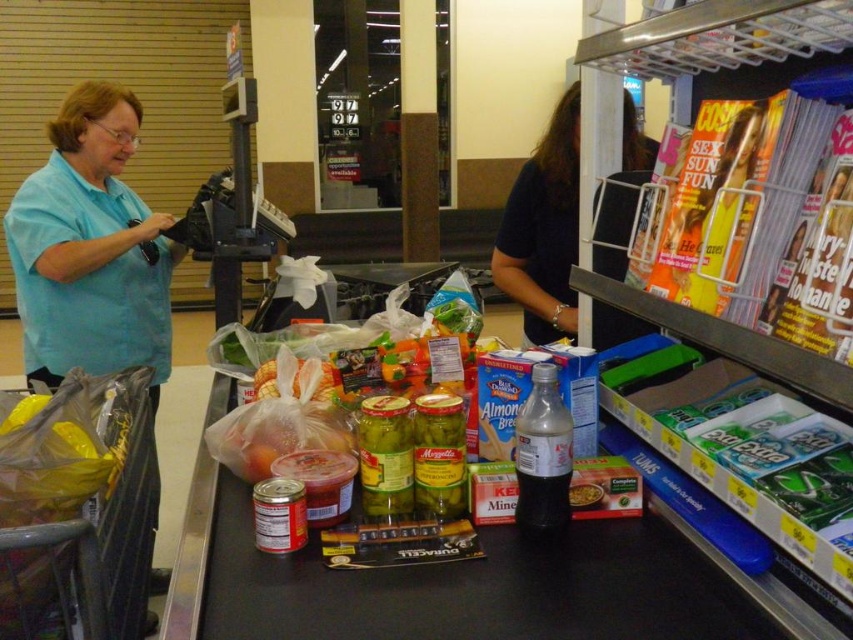
Which of these two, dark blue shirt at center or smooth plastic container at center, stands taller?

Standing taller between the two is dark blue shirt at center.

Between dark blue shirt at center and smooth plastic container at center, which one is positioned higher?

Positioned higher is dark blue shirt at center.

Is point (630, 115) behind point (593, 500)?

Yes, it is behind point (593, 500).

Where is `dark blue shirt at center`? The height and width of the screenshot is (640, 853). dark blue shirt at center is located at coordinates (544, 228).

Can you confirm if light blue shirt at left is bigger than dark blue shirt at center?

Indeed, light blue shirt at left has a larger size compared to dark blue shirt at center.

Does light blue shirt at left lie in front of dark blue shirt at center?

No, it is behind dark blue shirt at center.

Between point (119, 189) and point (509, 241), which one is positioned behind?

Point (119, 189)

You are a GUI agent. You are given a task and a screenshot of the screen. Output one action in this format:
    pyautogui.click(x=<x>, y=<y>)
    Task: Click on the light blue shirt at left
    The width and height of the screenshot is (853, 640).
    Given the screenshot: What is the action you would take?
    pyautogui.click(x=90, y=250)

Is point (67, 150) behind point (585, 492)?

Yes, it is behind point (585, 492).

Can you confirm if light blue shirt at left is thinner than smooth plastic container at center?

No, light blue shirt at left is not thinner than smooth plastic container at center.

Between point (28, 211) and point (589, 486), which one is positioned in front?

Point (589, 486) is more forward.

I want to click on light blue shirt at left, so click(90, 250).